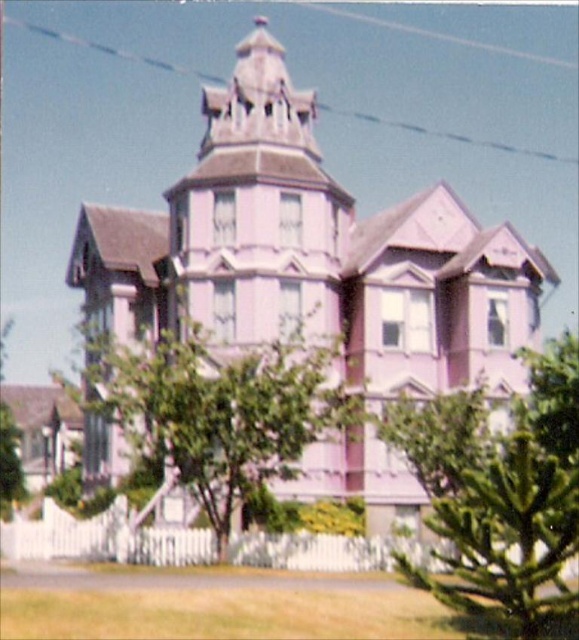
Question: Is green leafy tree at center positioned in front of green textured tree at lower right?

Choices:
 (A) no
 (B) yes

Answer: (A)

Question: Can you confirm if green textured tree at lower right is positioned to the left of green leafy tree at lower left?

Choices:
 (A) no
 (B) yes

Answer: (A)

Question: Is green textured tree at lower right thinner than green leafy tree at lower left?

Choices:
 (A) no
 (B) yes

Answer: (B)

Question: Estimate the real-world distances between objects in this image. Which object is farther from the green leafy tree at center?

Choices:
 (A) green textured tree at lower right
 (B) green leafy tree at lower left

Answer: (B)

Question: Which object appears farthest from the camera in this image?

Choices:
 (A) green leafy tree at lower left
 (B) green textured tree at lower right

Answer: (A)

Question: Which point is farther to the camera?

Choices:
 (A) green leafy tree at center
 (B) green textured tree at lower right

Answer: (A)